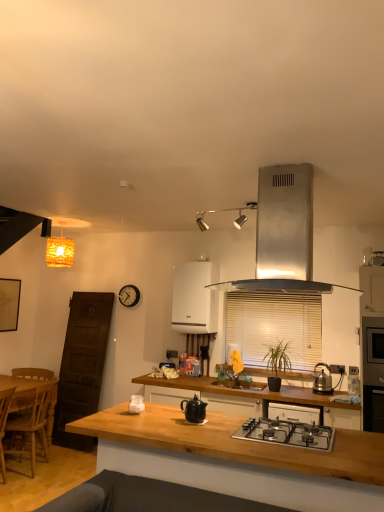
Question: Should I look upward or downward to see white blinds at center?

Choices:
 (A) down
 (B) up

Answer: (A)

Question: From a real-world perspective, is white glossy jar at center, which ranks as the 5th kitchen appliance in right-to-left order, physically above wooden chair at left?

Choices:
 (A) no
 (B) yes

Answer: (B)

Question: Does white glossy jar at center, the third kitchen appliance when ordered from front to back, have a greater width compared to wooden chair at left?

Choices:
 (A) no
 (B) yes

Answer: (A)

Question: From the image's perspective, would you say white glossy jar at center, the second kitchen appliance from the bottom, is positioned over wooden chair at left?

Choices:
 (A) yes
 (B) no

Answer: (A)

Question: Is white glossy jar at center, the second kitchen appliance from the bottom, to the right of wooden chair at left from the viewer's perspective?

Choices:
 (A) no
 (B) yes

Answer: (B)

Question: Can you confirm if white glossy jar at center, arranged as the 3th kitchen appliance when viewed from the back, is taller than wooden chair at left?

Choices:
 (A) no
 (B) yes

Answer: (A)

Question: Is white glossy jar at center, arranged as the 3th kitchen appliance when viewed from the back, smaller than wooden chair at left?

Choices:
 (A) yes
 (B) no

Answer: (A)

Question: From a real-world perspective, is wooden chair at left located higher than stainless steel gas stove at center?

Choices:
 (A) yes
 (B) no

Answer: (B)

Question: Is wooden chair at left outside stainless steel gas stove at center?

Choices:
 (A) no
 (B) yes

Answer: (B)

Question: Does wooden chair at left have a greater width compared to stainless steel gas stove at center?

Choices:
 (A) yes
 (B) no

Answer: (A)

Question: Would you say wooden chair at left is a long distance from stainless steel gas stove at center?

Choices:
 (A) yes
 (B) no

Answer: (A)

Question: Is wooden chair at left smaller than stainless steel gas stove at center?

Choices:
 (A) no
 (B) yes

Answer: (A)

Question: Considering the relative sizes of wooden chair at left and stainless steel gas stove at center in the image provided, is wooden chair at left thinner than stainless steel gas stove at center?

Choices:
 (A) no
 (B) yes

Answer: (A)

Question: Could you tell me if wooden at center is turned towards orange woven lampshade at upper left?

Choices:
 (A) yes
 (B) no

Answer: (B)